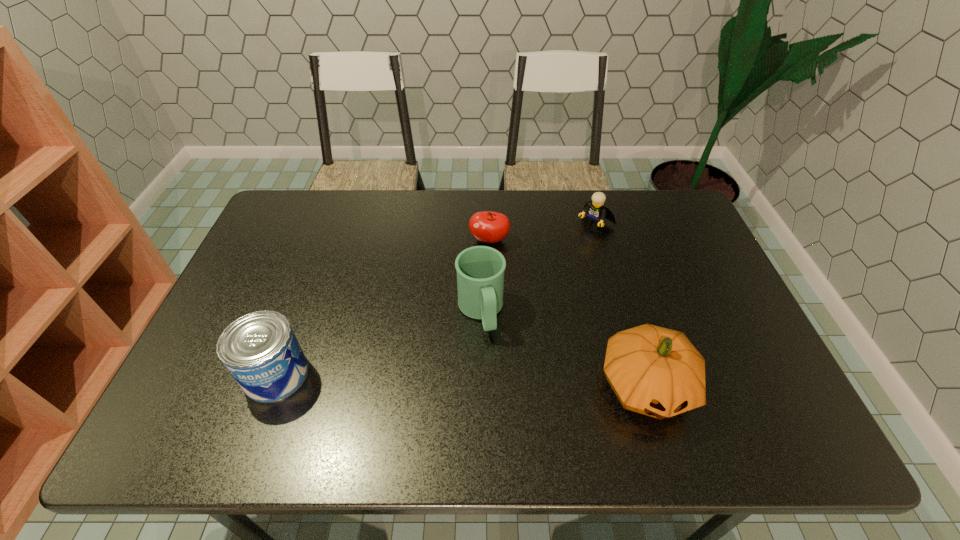
What are the coordinates of `vacant space located 0.060m on the front-facing side of the Lego` in the screenshot? It's located at (576, 241).

At what (x,y) coordinates should I click in order to perform the action: click on apple that is at the far edge. Please return your answer as a coordinate pair (x, y). The height and width of the screenshot is (540, 960). Looking at the image, I should click on (489, 227).

The width and height of the screenshot is (960, 540). What are the coordinates of `Lego located in the far edge section of the desktop` in the screenshot? It's located at (596, 213).

Image resolution: width=960 pixels, height=540 pixels. In order to click on can located in the near edge section of the desktop in this screenshot , I will do `click(260, 350)`.

Where is `gourd that is at the near edge`? This screenshot has height=540, width=960. gourd that is at the near edge is located at coordinates (655, 371).

You are a GUI agent. You are given a task and a screenshot of the screen. Output one action in this format:
    pyautogui.click(x=<x>, y=<y>)
    Task: Click on the object that is at the left edge
    This screenshot has height=540, width=960.
    Given the screenshot: What is the action you would take?
    pyautogui.click(x=260, y=350)

Where is `object located in the near left corner section of the desktop`? object located in the near left corner section of the desktop is located at coordinates 260,350.

This screenshot has width=960, height=540. In order to click on vacant space at the far edge of the desktop in this screenshot , I will do `click(411, 206)`.

In the image, there is a desktop. Find the location of `vacant space at the left edge`. vacant space at the left edge is located at coordinates (202, 366).

Where is `free space at the right edge of the desktop`? The width and height of the screenshot is (960, 540). free space at the right edge of the desktop is located at coordinates click(x=698, y=237).